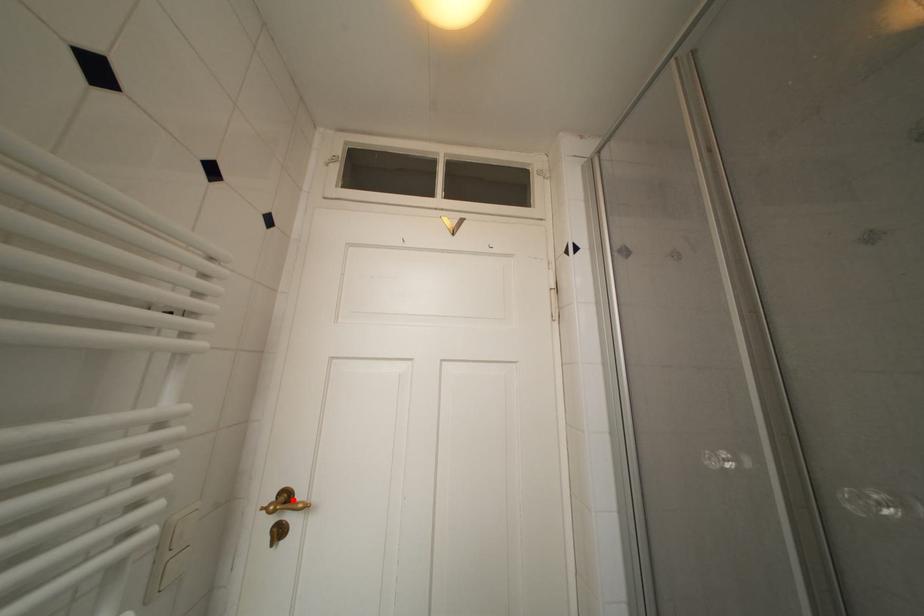
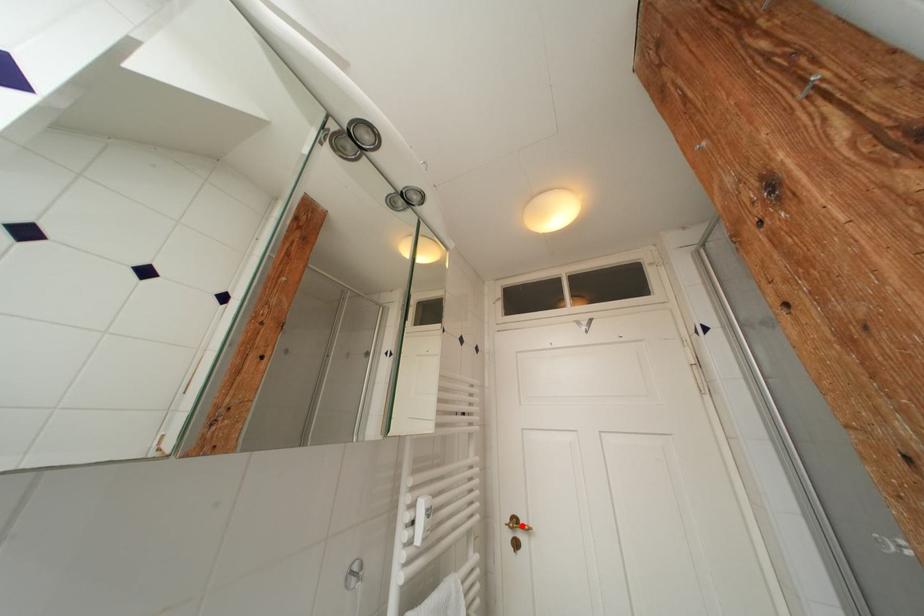
I am providing you with two images of the same scene from different viewpoints. A red point is marked on the first image and another point is marked on the second image. Is the marked point in image1 the same physical position as the marked point in image2?

Yes